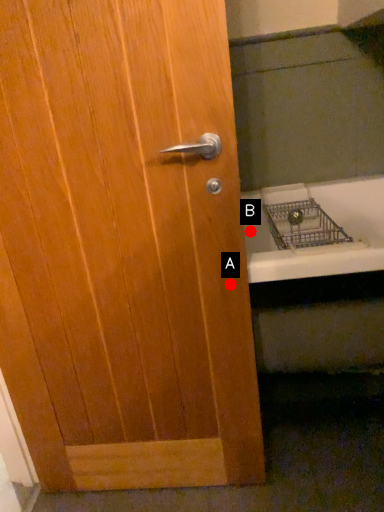
Question: Two points are circled on the image, labeled by A and B beside each circle. Which point is closer to the camera?

Choices:
 (A) A is closer
 (B) B is closer

Answer: (A)